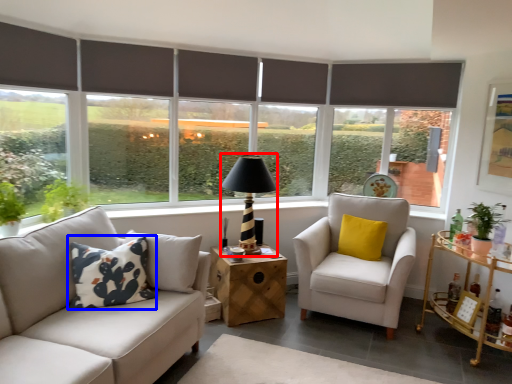
Question: Among these objects, which one is farthest to the camera, table lamp (highlighted by a red box) or pillow (highlighted by a blue box)?

Choices:
 (A) table lamp
 (B) pillow

Answer: (A)